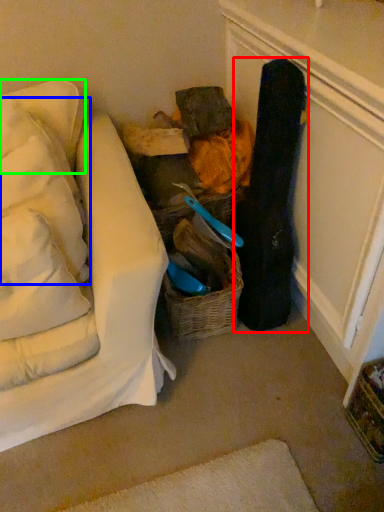
Question: Estimate the real-world distances between objects in this image. Which object is closer to clothing (highlighted by a red box), pillow (highlighted by a blue box) or pillow (highlighted by a green box)?

Choices:
 (A) pillow
 (B) pillow

Answer: (A)